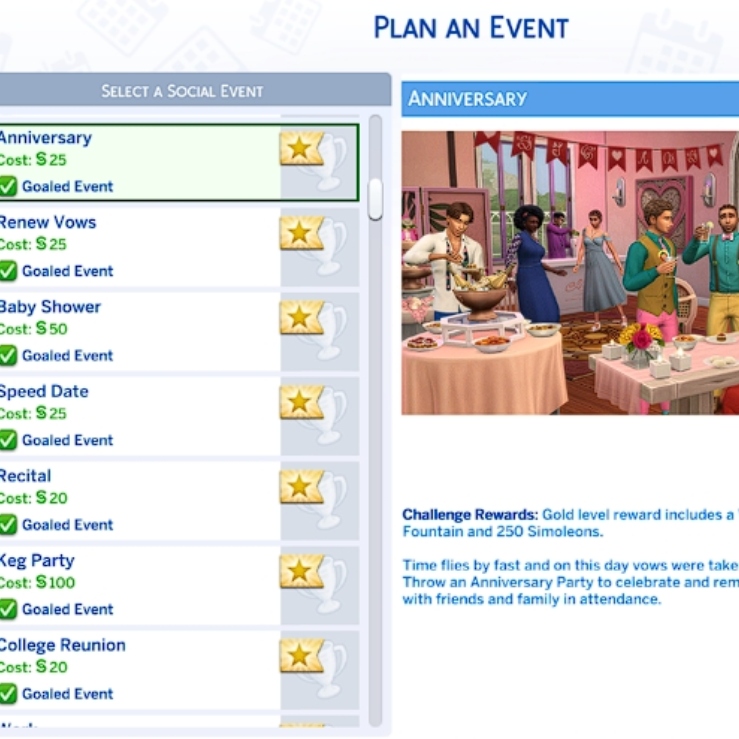
Image resolution: width=739 pixels, height=739 pixels. Find the location of `tall windows, top left corner of banquet image, top right`. tall windows, top left corner of banquet image, top right is located at coordinates (494, 170), (508, 171), (545, 174), (565, 180).